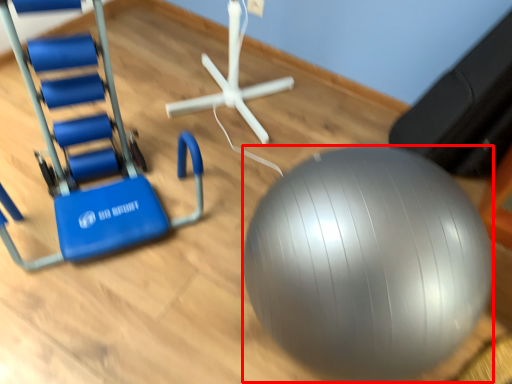
Question: From the image's perspective, considering the relative positions of ball (annotated by the red box) and swivel chair in the image provided, where is ball (annotated by the red box) located with respect to the staircase?

Choices:
 (A) below
 (B) above

Answer: (A)